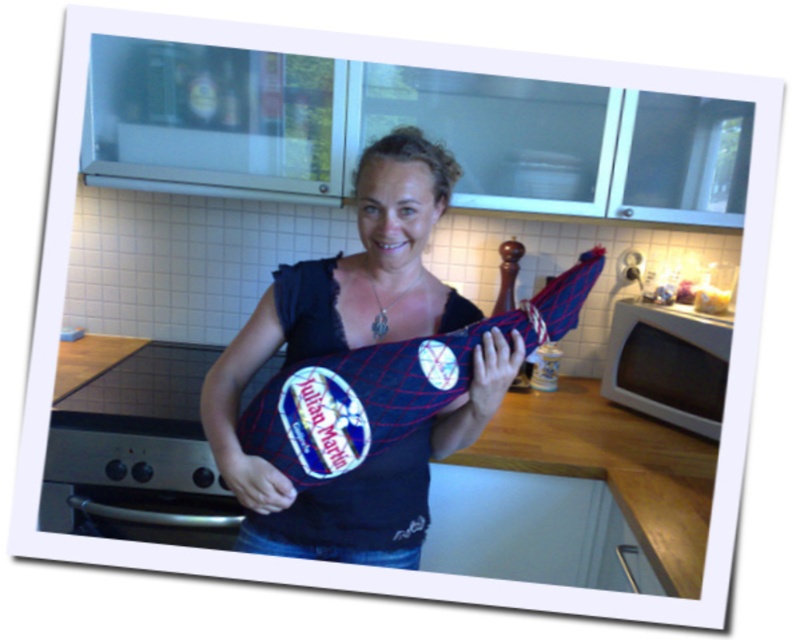
This screenshot has width=796, height=640. Describe the element at coordinates (354, 348) in the screenshot. I see `matte black shirt at center` at that location.

Between matte black shirt at center and white matte microwave at lower right, which one is positioned higher?

matte black shirt at center

The image size is (796, 640). What are the coordinates of `matte black shirt at center` in the screenshot? It's located at (354, 348).

Where is `matte black shirt at center`? matte black shirt at center is located at coordinates (354, 348).